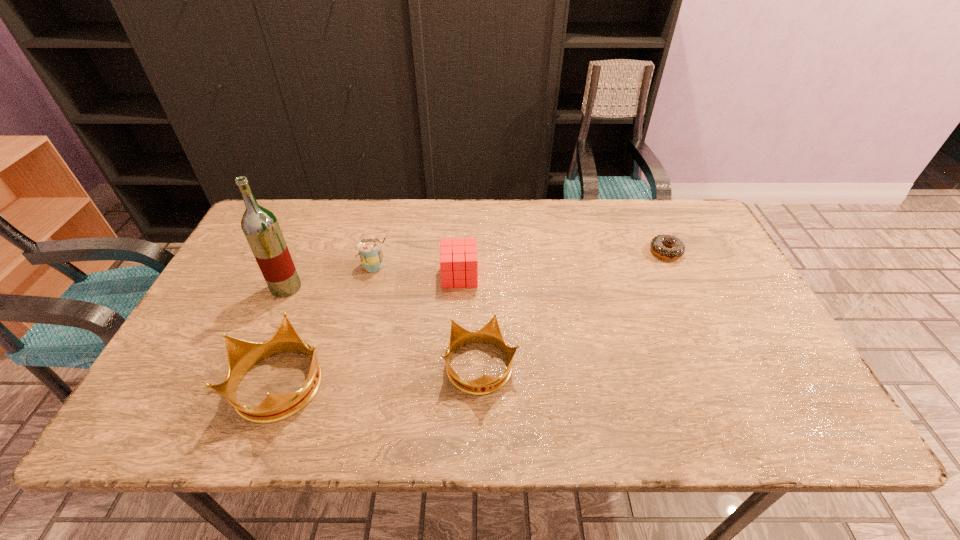
The width and height of the screenshot is (960, 540). In order to click on empty location between the tallest object and the cube in this screenshot , I will do `click(372, 282)`.

Where is `unoccupied area between the shorter crown and the rightmost object`? unoccupied area between the shorter crown and the rightmost object is located at coordinates (573, 309).

Find the location of a particular element. The image size is (960, 540). empty space that is in between the third object from left to right and the cube is located at coordinates (418, 271).

Image resolution: width=960 pixels, height=540 pixels. Identify the location of the fifth closest object to the cube. (x=658, y=243).

Identify the location of object that is the fifth closest to the shortest object. (260, 226).

You are a GUI agent. You are given a task and a screenshot of the screen. Output one action in this format:
    pyautogui.click(x=<x>, y=<y>)
    Task: Click on the vacant area that satisfies the following two spatial constraints: 1. on the front side of the liquor; 2. on the right side of the taller crown
    The image size is (960, 540).
    Given the screenshot: What is the action you would take?
    pyautogui.click(x=244, y=382)

Find the location of a particular element. The image size is (960, 540). vacant space that satisfies the following two spatial constraints: 1. on the front side of the cube; 2. on the left side of the can is located at coordinates (372, 276).

This screenshot has width=960, height=540. In order to click on free spot that satisfies the following two spatial constraints: 1. on the back side of the left crown; 2. on the left side of the shortest object in this screenshot , I will do `click(330, 252)`.